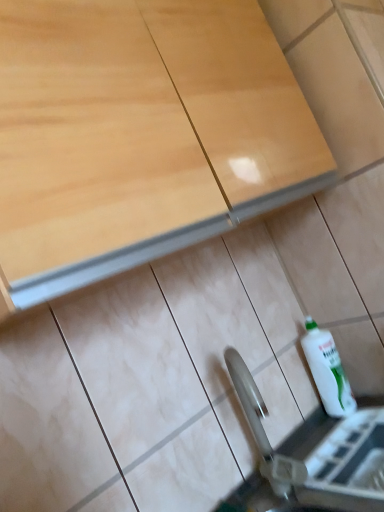
Question: Considering the positions of white glossy bottle at lower right and matte wood cabinet at upper center in the image, is white glossy bottle at lower right wider or thinner than matte wood cabinet at upper center?

Choices:
 (A) thin
 (B) wide

Answer: (A)

Question: Relative to matte wood cabinet at upper center, is white glossy bottle at lower right in front or behind?

Choices:
 (A) front
 (B) behind

Answer: (B)

Question: Considering the real-world distances, which object is closest to the white glossy bottle at lower right?

Choices:
 (A) matte wood cabinet at upper center
 (B) metallic silver sink at lower center

Answer: (B)

Question: Estimate the real-world distances between objects in this image. Which object is farther from the matte wood cabinet at upper center?

Choices:
 (A) metallic silver sink at lower center
 (B) white glossy bottle at lower right

Answer: (B)